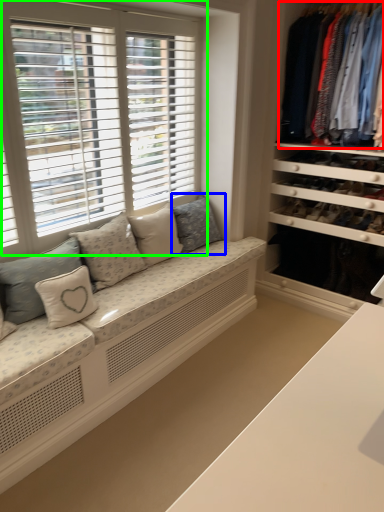
Question: Which object is positioned farthest from clothing (highlighted by a red box)? Select from pillow (highlighted by a blue box) and window (highlighted by a green box).

Choices:
 (A) pillow
 (B) window

Answer: (B)